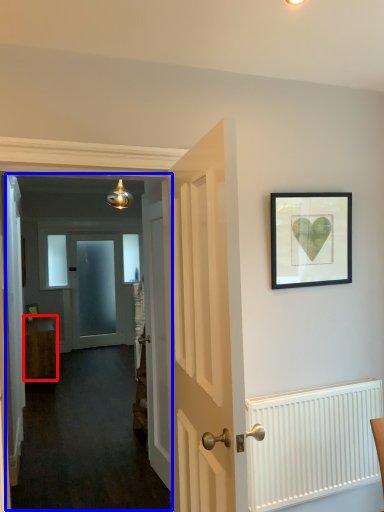
Question: Which point is closer to the camera, furniture (highlighted by a red box) or corridor (highlighted by a blue box)?

Choices:
 (A) furniture
 (B) corridor

Answer: (B)